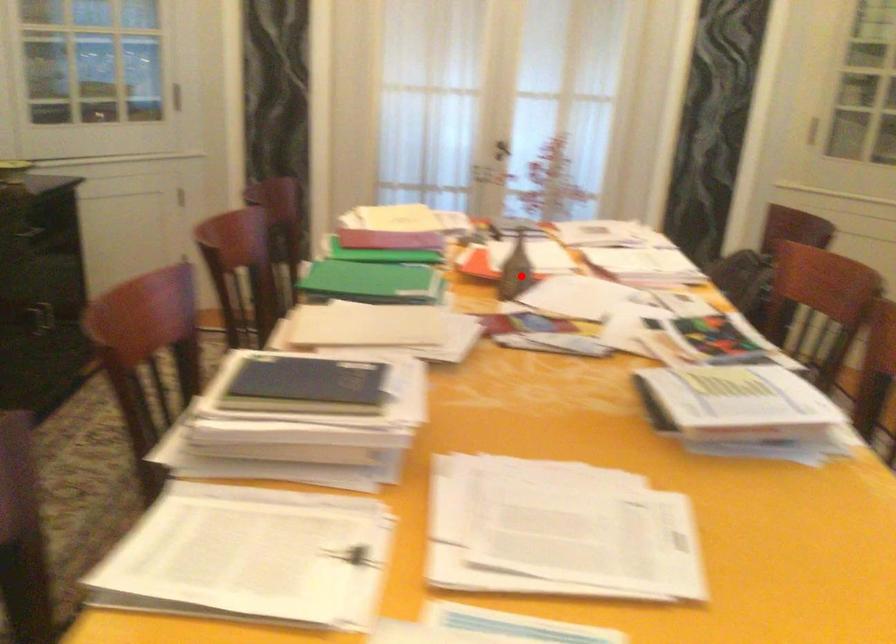
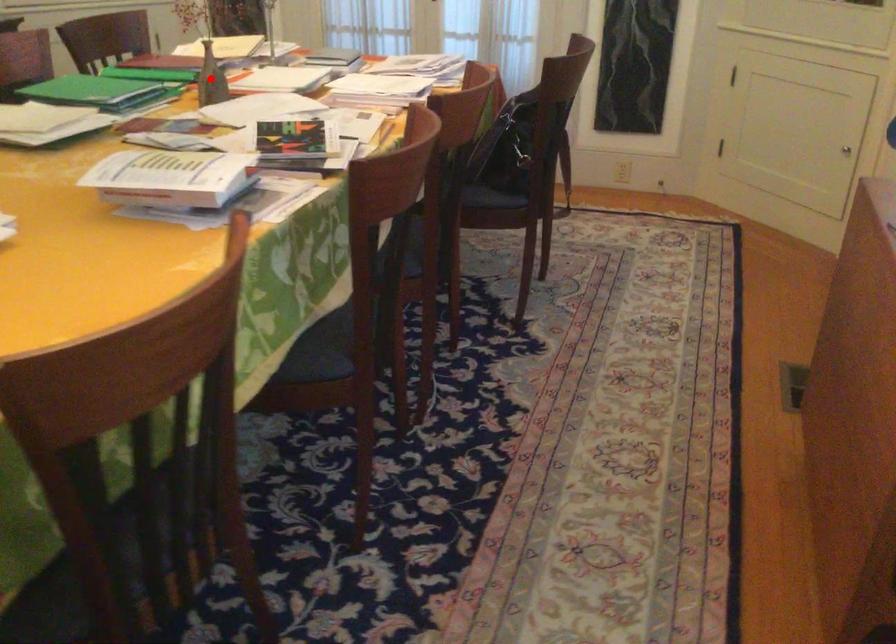
I am providing you with two images of the same scene from different viewpoints. A red point is marked on the first image and another point is marked on the second image. Are the points marked in image1 and image2 representing the same 3D position?

Yes